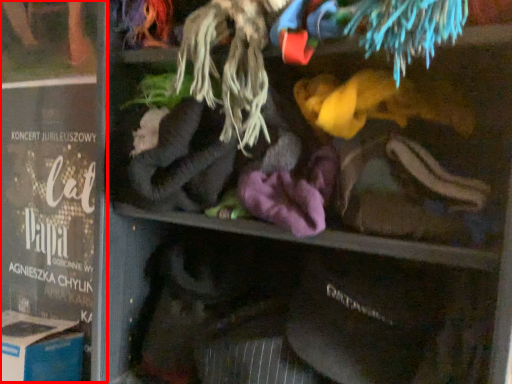
Question: From the image's perspective, what is the correct spatial relationship of book (annotated by the red box) in relation to cardboard box?

Choices:
 (A) below
 (B) above

Answer: (B)